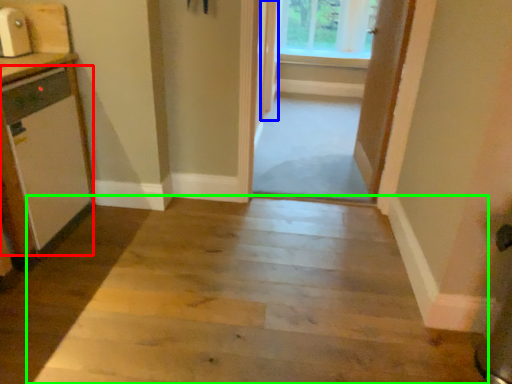
Question: Based on their relative distances, which object is nearer to appliance (highlighted by a red box)? Choose from door (highlighted by a blue box) and path (highlighted by a green box).

Choices:
 (A) door
 (B) path

Answer: (B)